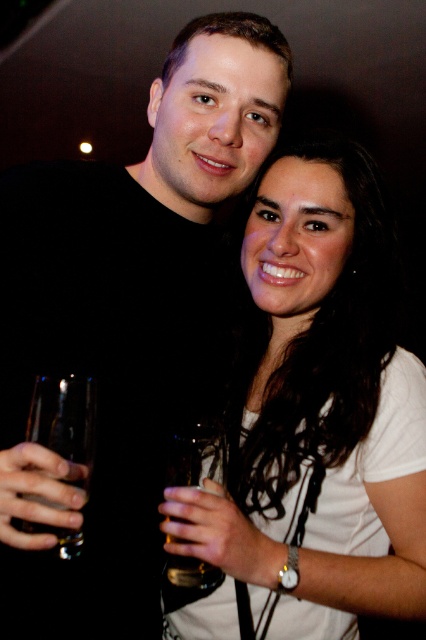
Question: Does matte black shirt at center appear on the right side of translucent glass at center?

Choices:
 (A) yes
 (B) no

Answer: (B)

Question: Can you confirm if matte black shirt at center is thinner than white matte shirt at center?

Choices:
 (A) yes
 (B) no

Answer: (B)

Question: Among these objects, which one is farthest from the camera?

Choices:
 (A) clear glass wine glass at left
 (B) matte black shirt at center
 (C) translucent glass at center
 (D) white matte shirt at center

Answer: (C)

Question: Which of the following is the farthest from the observer?

Choices:
 (A) (29, 355)
 (B) (354, 296)

Answer: (B)

Question: Can you confirm if white matte shirt at center is bigger than translucent glass at center?

Choices:
 (A) yes
 (B) no

Answer: (A)

Question: Considering the real-world distances, which object is farthest from the translucent glass at center?

Choices:
 (A) matte black shirt at center
 (B) clear glass wine glass at left
 (C) white matte shirt at center

Answer: (A)